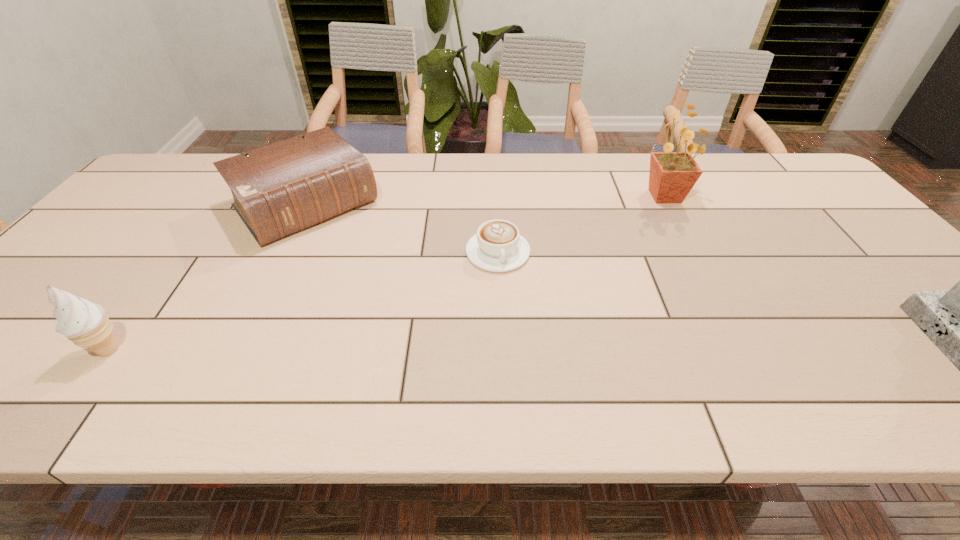
In order to click on icecream in this screenshot , I will do pyautogui.click(x=83, y=322).

At what (x,y) coordinates should I click in order to perform the action: click on the leftmost object. Please return your answer as a coordinate pair (x, y). The width and height of the screenshot is (960, 540). Looking at the image, I should click on click(83, 322).

Locate an element on the screen. the shortest object is located at coordinates (497, 247).

This screenshot has height=540, width=960. I want to click on the second object from right to left, so (497, 247).

Find the location of a particular element. Image resolution: width=960 pixels, height=540 pixels. the rightmost object is located at coordinates (672, 175).

I want to click on the tallest object, so (672, 175).

Identify the location of the second object from left to right. This screenshot has width=960, height=540. pyautogui.click(x=280, y=189).

You are a GUI agent. You are given a task and a screenshot of the screen. Output one action in this format:
    pyautogui.click(x=<x>, y=<y>)
    Task: Click on the third tallest object
    The image size is (960, 540).
    Given the screenshot: What is the action you would take?
    pyautogui.click(x=280, y=189)

Identify the location of free space located with the handle on the right side of the shortest object. This screenshot has width=960, height=540. (536, 335).

Where is `blank space located 0.190m with the handle on the right side of the shortest object`? The height and width of the screenshot is (540, 960). blank space located 0.190m with the handle on the right side of the shortest object is located at coordinates (534, 332).